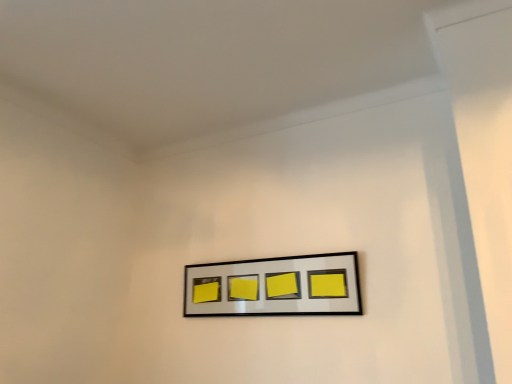
Where is `matte black picture frame at center`? matte black picture frame at center is located at coordinates (275, 286).

Describe the element at coordinates (275, 286) in the screenshot. I see `matte black picture frame at center` at that location.

At what (x,y) coordinates should I click in order to perform the action: click on matte black picture frame at center. Please return your answer as a coordinate pair (x, y). Looking at the image, I should click on (275, 286).